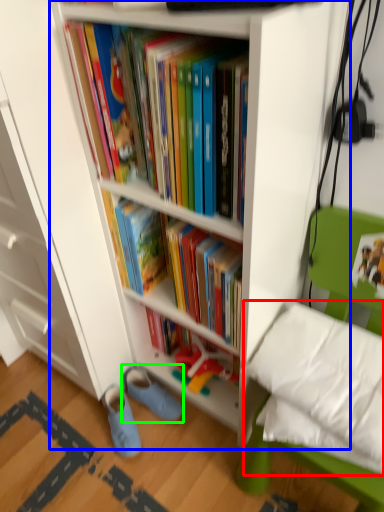
Question: Estimate the real-world distances between objects in this image. Which object is farther from pillow (highlighted by a red box), bookcase (highlighted by a blue box) or footwear (highlighted by a green box)?

Choices:
 (A) bookcase
 (B) footwear

Answer: (B)